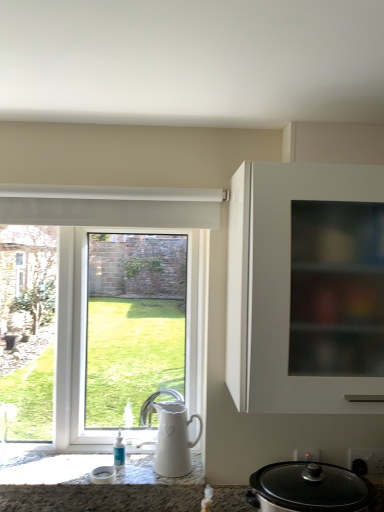
At what (x,y) coordinates should I click in order to perform the action: click on blank area to the left of white ceramic jug at lower center. Please return your answer as a coordinate pair (x, y). The image size is (384, 512). Looking at the image, I should click on (137, 465).